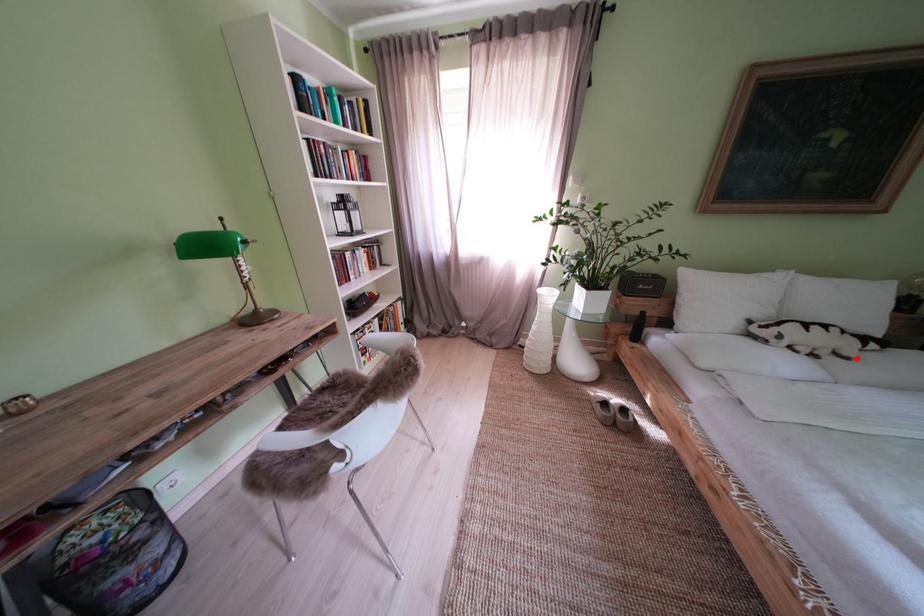
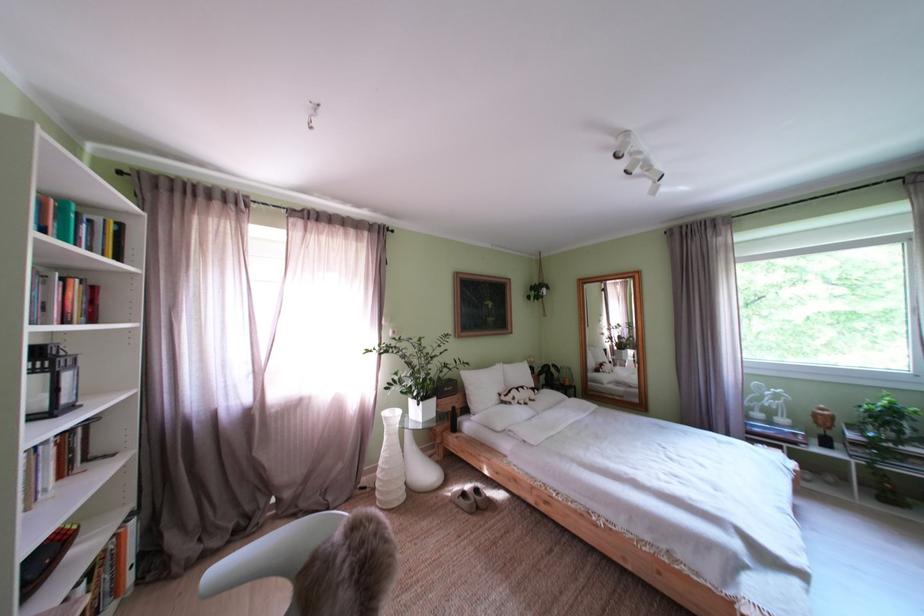
Question: I am providing you with two images of the same scene from different viewpoints. Given a red point in image1, look at the same physical point in image2. Is it:

Choices:
 (A) Closer to the viewpoint
 (B) Farther from the viewpoint

Answer: (B)